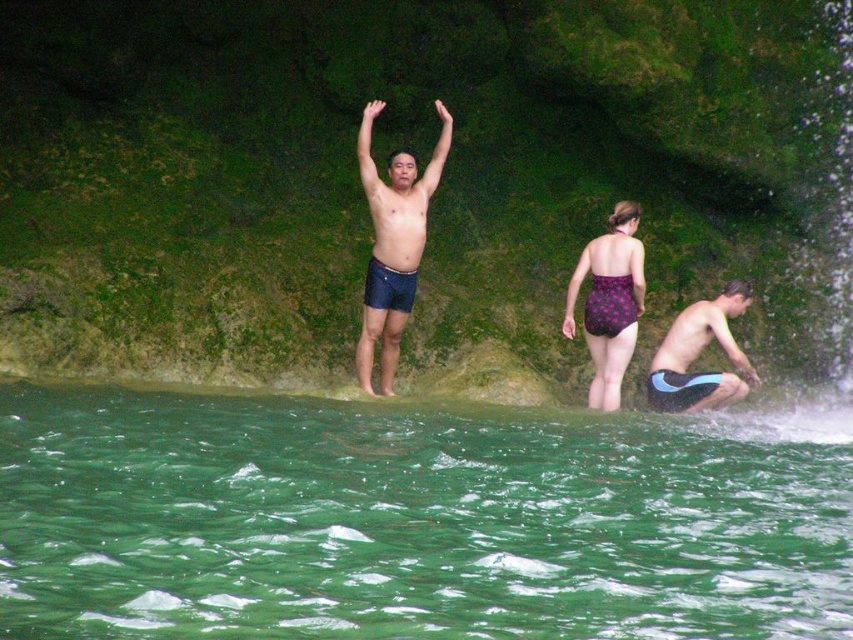
Question: Can you confirm if green translucent water at lower center is smaller than blue and white swim trunks at lower right?

Choices:
 (A) yes
 (B) no

Answer: (B)

Question: Which point is farther to the camera?

Choices:
 (A) (403, 189)
 (B) (712, 406)

Answer: (A)

Question: Which object appears closest to the camera in this image?

Choices:
 (A) green translucent water at lower center
 (B) blue and white swim trunks at lower right
 (C) dark blue swim trunks at center
 (D) purple floral swimsuit at center

Answer: (A)

Question: Which of these objects is positioned closest to the green translucent water at lower center?

Choices:
 (A) blue and white swim trunks at lower right
 (B) purple floral swimsuit at center

Answer: (A)

Question: Does green translucent water at lower center have a larger size compared to dark blue shorts at center?

Choices:
 (A) no
 (B) yes

Answer: (B)

Question: Does dark blue swim trunks at center have a lesser width compared to blue and white swim trunks at lower right?

Choices:
 (A) yes
 (B) no

Answer: (A)